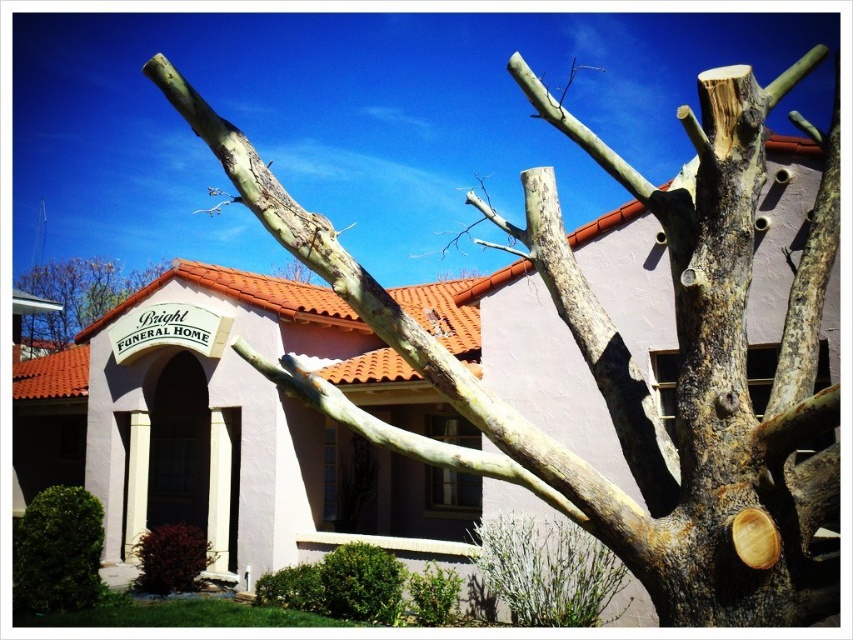
Can you confirm if brown rough bark tree at upper right is positioned above smooth bark tree at center?

Yes.

From the picture: Who is more forward, (186, 99) or (64, 269)?

Point (186, 99)

This screenshot has height=640, width=853. I want to click on brown rough bark tree at upper right, so click(x=630, y=360).